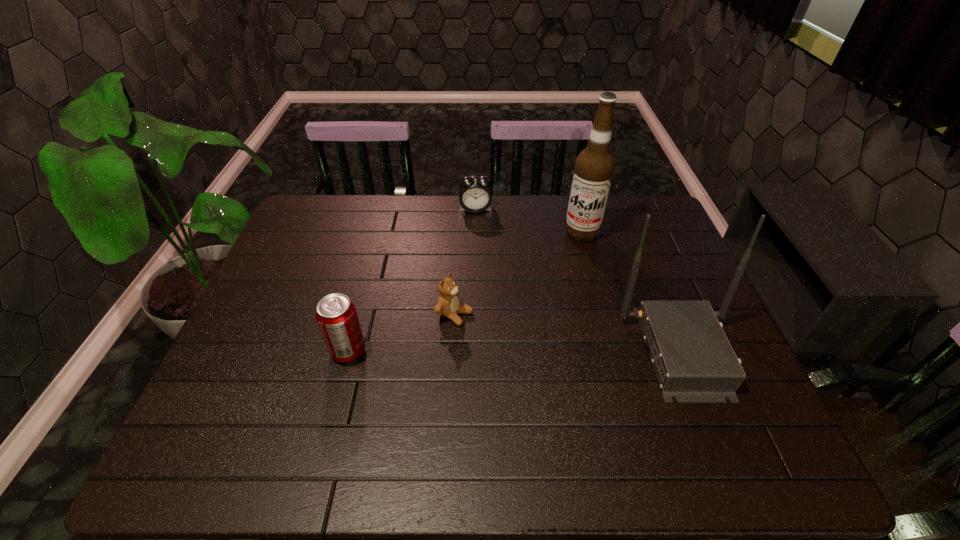
What are the coordinates of `blank space located 0.370m on the label of the tallest object` in the screenshot? It's located at (551, 329).

This screenshot has width=960, height=540. What are the coordinates of `free space located on the front side of the farthest object` in the screenshot? It's located at (486, 299).

What are the coordinates of `free space located 0.240m on the front side of the farthest object` in the screenshot? It's located at (482, 262).

Find the location of a particular element. vacant space located on the front side of the farthest object is located at coordinates (486, 299).

At what (x,y) coordinates should I click in order to perform the action: click on free space located on the front-facing side of the teddy bear. Please return your answer as a coordinate pair (x, y). The height and width of the screenshot is (540, 960). Looking at the image, I should click on (546, 357).

You are a GUI agent. You are given a task and a screenshot of the screen. Output one action in this format:
    pyautogui.click(x=<x>, y=<y>)
    Task: Click on the free space located on the front-facing side of the teddy bear
    
    Given the screenshot: What is the action you would take?
    pyautogui.click(x=496, y=333)

The width and height of the screenshot is (960, 540). Find the location of `free space located 0.220m on the front-facing side of the teddy bear`. free space located 0.220m on the front-facing side of the teddy bear is located at coordinates point(546,357).

Image resolution: width=960 pixels, height=540 pixels. Identify the location of alcohol positioned at the far edge. (594, 167).

This screenshot has width=960, height=540. In order to click on alarm clock positioned at the far edge in this screenshot , I will do `click(475, 196)`.

Identify the location of object located at the near edge. The width and height of the screenshot is (960, 540). (693, 360).